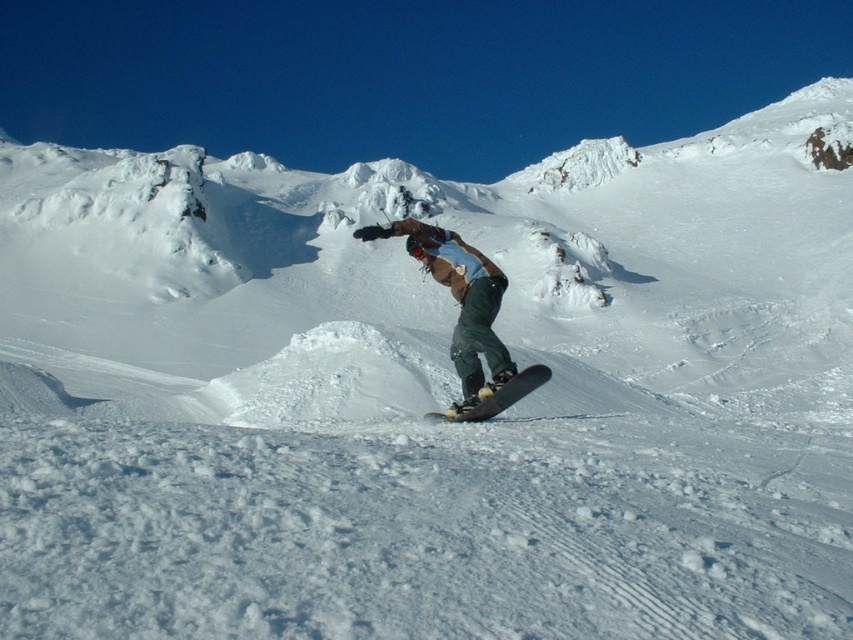
Is green fabric snowboarder at center taller than black matte snowboard at center?

Indeed, green fabric snowboarder at center has a greater height compared to black matte snowboard at center.

Which is in front, point (494, 403) or point (492, 397)?

Point (494, 403) is more forward.

At what (x,y) coordinates should I click in order to perform the action: click on green fabric snowboarder at center. Please return your answer as a coordinate pair (x, y). This screenshot has width=853, height=640. Looking at the image, I should click on (467, 317).